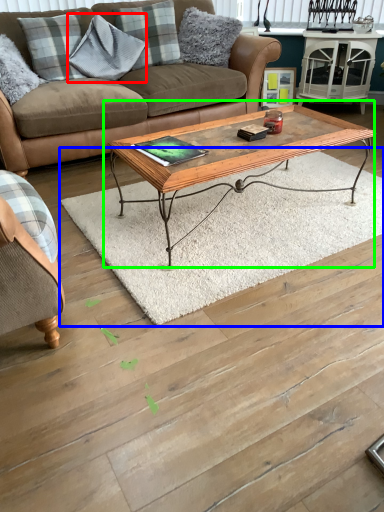
Question: Which object is the closest to the pillow (highlighted by a red box)? Choose among these: mat (highlighted by a blue box) or coffee table (highlighted by a green box).

Choices:
 (A) mat
 (B) coffee table

Answer: (B)